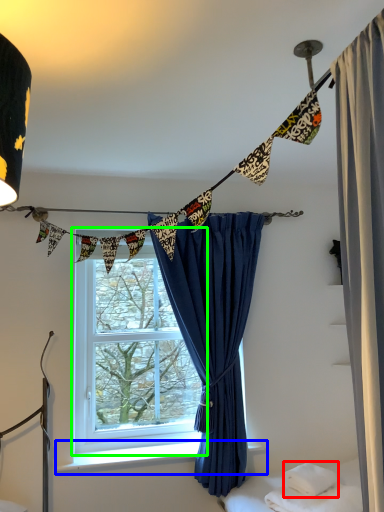
Question: Which object is positioned closest to pillow (highlighted by a red box)? Select from window sill (highlighted by a blue box) and window (highlighted by a green box).

Choices:
 (A) window sill
 (B) window

Answer: (A)